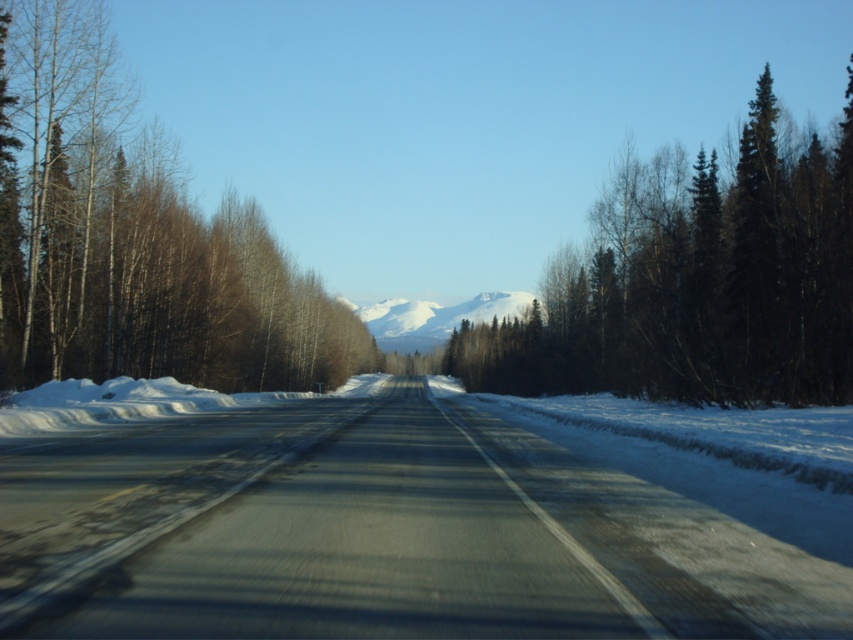
You are a driver navigating a snowy road. You notice brown bark trees at left and a dark green textured evergreen tree at right. Which side of the road has wider trees?

The dark green textured evergreen tree at right has a wider width than the brown bark trees at left.

You are driving along a snowy road and notice two types of trees. The brown bark trees at left and the dark green textured evergreen tree at right. Which of these two trees is closer to the road?

The brown bark trees at left are closer to the road because they are positioned below the dark green textured evergreen tree at right, indicating they are in a lower elevation and thus nearer to the road level.

You are driving a car that is 5 meters wide. You need to cross a gap between the brown bark trees at left and the dark green textured evergreen tree at right. Can your car fit through the gap?

The gap between the brown bark trees at left and the dark green textured evergreen tree at right is 26.77 meters. Since your car is only 5 meters wide, it can easily fit through the gap as the width is more than sufficient.